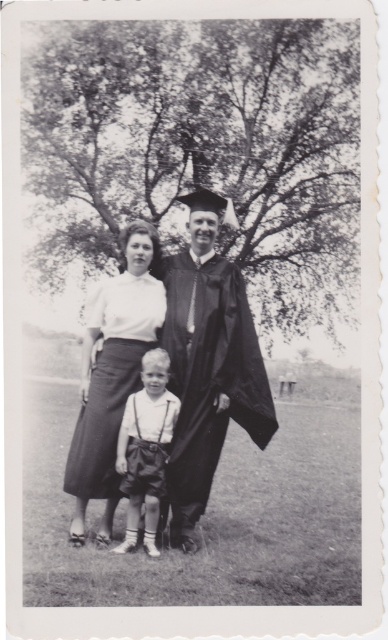
Question: Which object is positioned closest to the matte black graduation gown at center?

Choices:
 (A) smooth white shirt at center
 (B) matte white blouse at center

Answer: (A)

Question: Is matte white blouse at center positioned in front of smooth white shirt at center?

Choices:
 (A) yes
 (B) no

Answer: (B)

Question: Can you confirm if matte white blouse at center is smaller than smooth white shirt at center?

Choices:
 (A) no
 (B) yes

Answer: (A)

Question: Which point is farther from the camera taking this photo?

Choices:
 (A) (169, 428)
 (B) (259, 381)
 (C) (154, 237)

Answer: (C)

Question: Does matte black graduation gown at center have a lesser width compared to smooth white shirt at center?

Choices:
 (A) yes
 (B) no

Answer: (B)

Question: Which point appears farthest from the camera in this image?

Choices:
 (A) (187, 500)
 (B) (143, 362)
 (C) (79, 500)

Answer: (B)